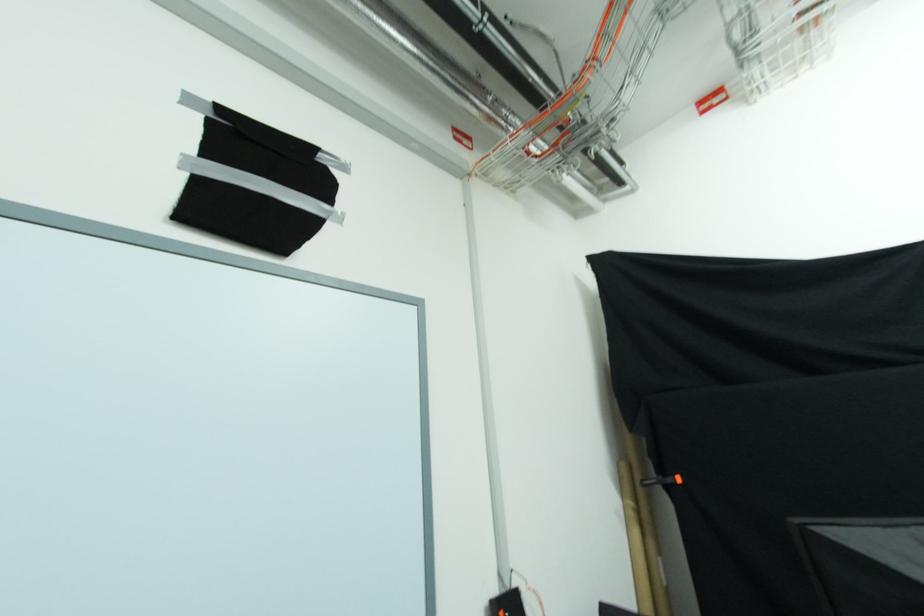
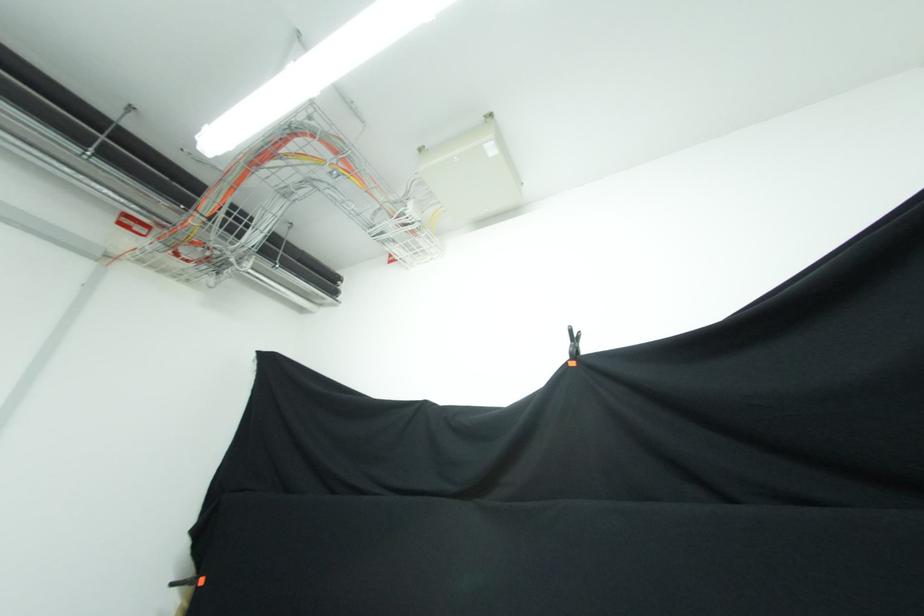
In a continuous first-person perspective shot, in which direction is the camera moving?

The movement direction of the cameraman is right, backward.